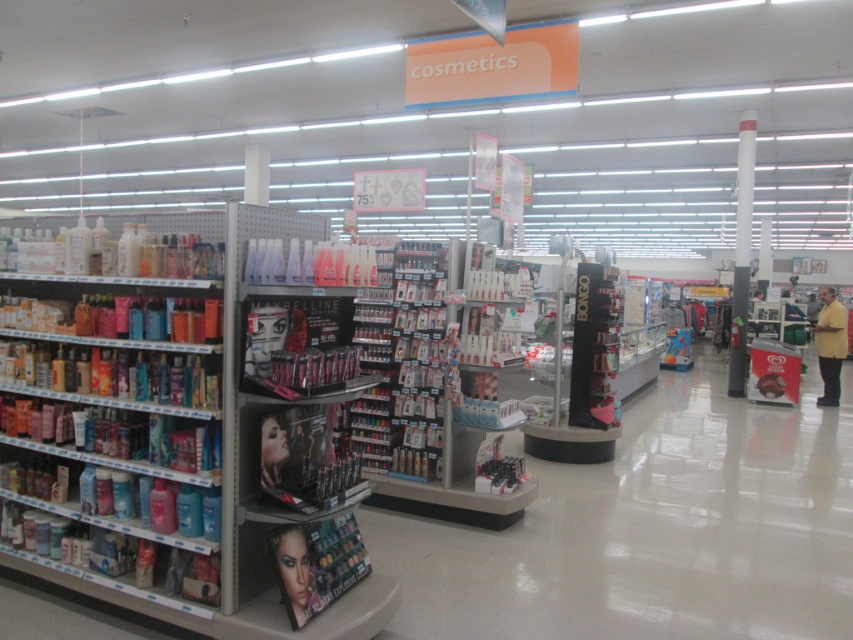
Does white glossy pillar at center have a smaller size compared to yellow matte shirt at right?

Correct, white glossy pillar at center occupies less space than yellow matte shirt at right.

Who is lower down, white glossy pillar at center or yellow matte shirt at right?

Positioned lower is yellow matte shirt at right.

Locate an element on the screen. The height and width of the screenshot is (640, 853). white glossy pillar at center is located at coordinates (741, 253).